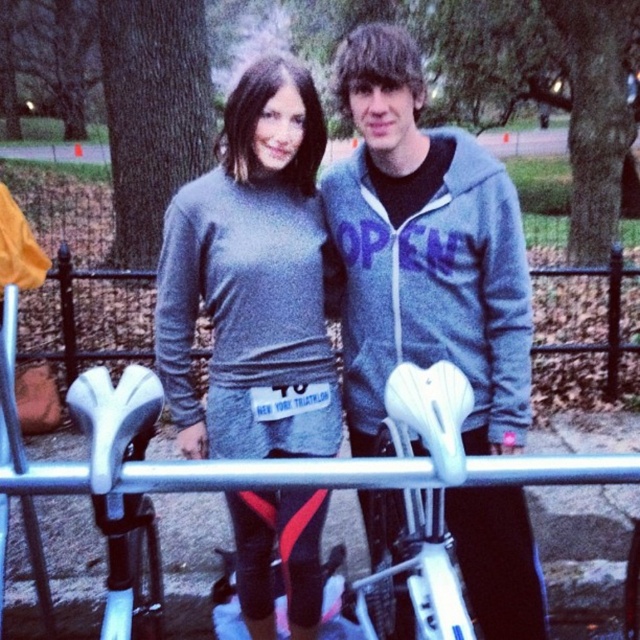
Question: Does gray fleece jacket at center appear under gray matte sweater at center?

Choices:
 (A) no
 (B) yes

Answer: (A)

Question: Is gray fleece jacket at center bigger than white matte bicycle seat at center?

Choices:
 (A) yes
 (B) no

Answer: (A)

Question: Which of these objects is positioned closest to the white matte bicycle seat at center?

Choices:
 (A) gray matte sweater at center
 (B) gray fleece jacket at center

Answer: (A)

Question: Which point appears farthest from the camera in this image?

Choices:
 (A) (369, 353)
 (B) (90, 371)
 (C) (314, 337)

Answer: (A)

Question: Among these points, which one is nearest to the camera?

Choices:
 (A) (493, 442)
 (B) (282, 166)

Answer: (A)

Question: Is gray fleece jacket at center smaller than gray matte sweater at center?

Choices:
 (A) no
 (B) yes

Answer: (A)